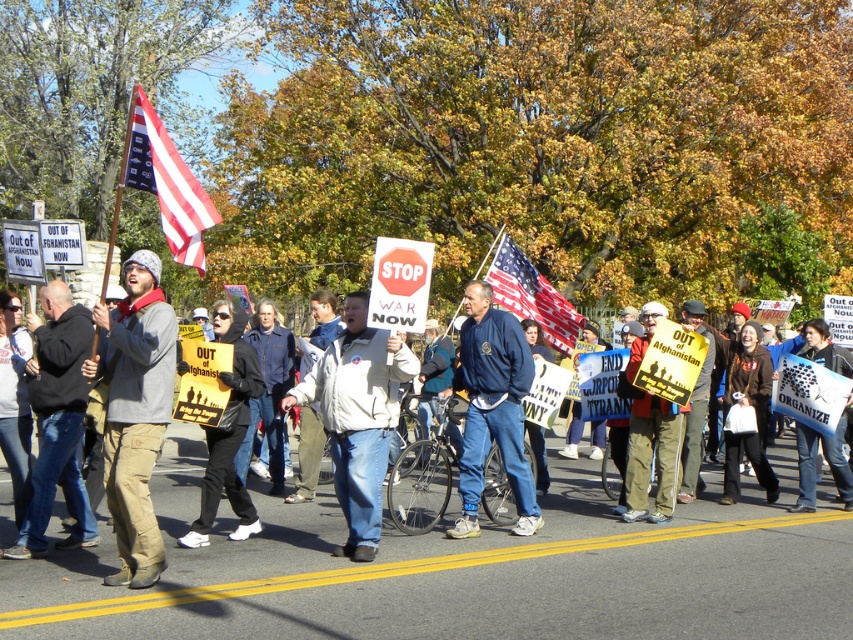
Question: Which point is farther to the camera?

Choices:
 (A) white matte jacket at center
 (B) blue fleece jacket at center
 (C) white paper sign at center

Answer: (C)

Question: Can you confirm if white cotton jacket at center is positioned above white paper sign at center?

Choices:
 (A) no
 (B) yes

Answer: (B)

Question: Is black jacket at left above blue fleece jacket at center?

Choices:
 (A) no
 (B) yes

Answer: (A)

Question: Can you confirm if white matte jacket at center is positioned below matte yellow sign at center?

Choices:
 (A) no
 (B) yes

Answer: (A)

Question: Which is farther from the american flag at upper left?

Choices:
 (A) white matte jacket at center
 (B) black fabric sign at center

Answer: (A)

Question: Which of these objects is positioned closest to the black fabric sign at center?

Choices:
 (A) white matte jacket at center
 (B) american flag at center
 (C) blue fleece jacket at center
 (D) white paper sign at center

Answer: (A)